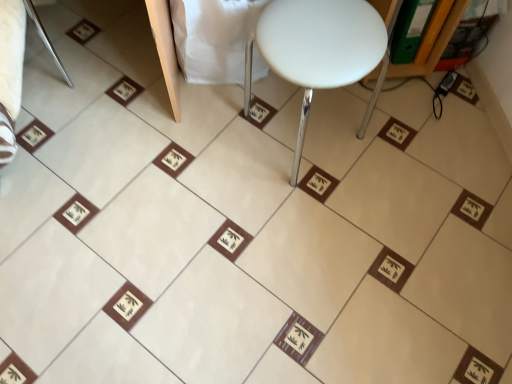
I want to click on vacant area that lies to the right of white glossy stool at center, so click(x=404, y=147).